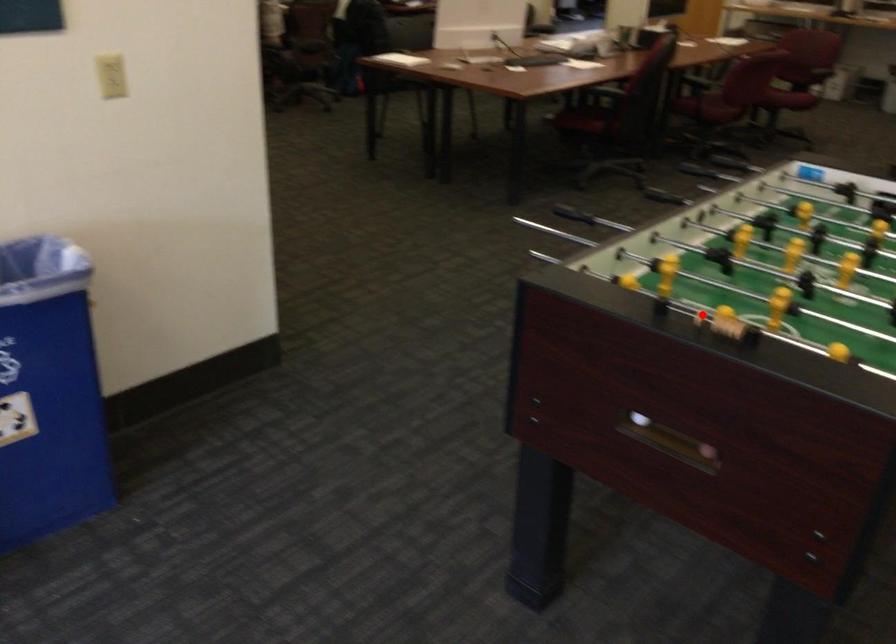
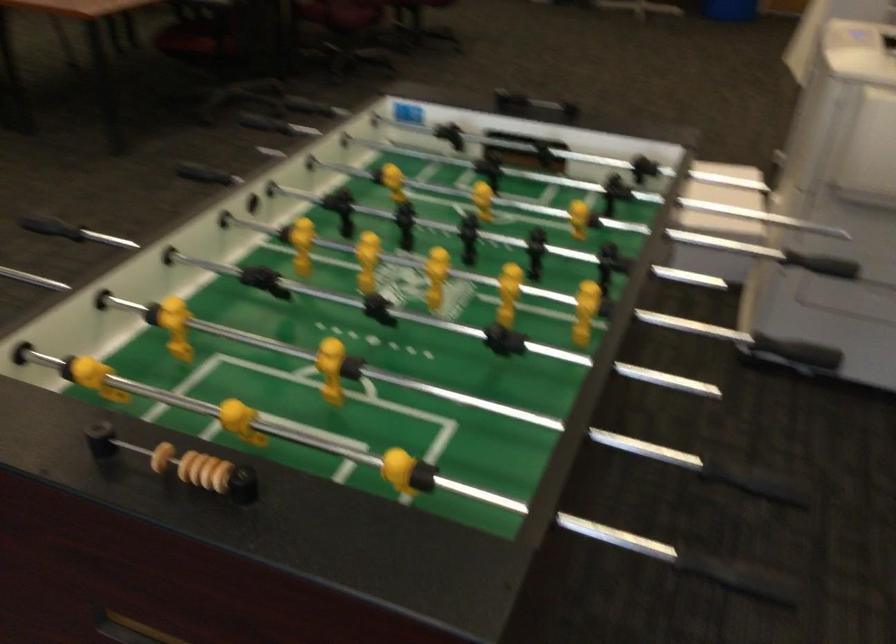
Find the pixel in the second image that matches the highlighted location in the first image.

(161, 457)